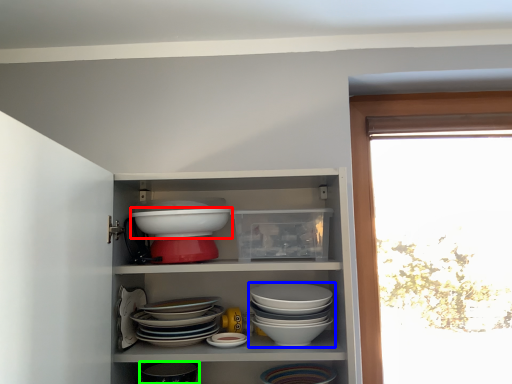
Question: Which object is positioned closest to bowl (highlighted by a red box)? Select from bowl (highlighted by a blue box) and tableware (highlighted by a green box).

Choices:
 (A) bowl
 (B) tableware

Answer: (A)